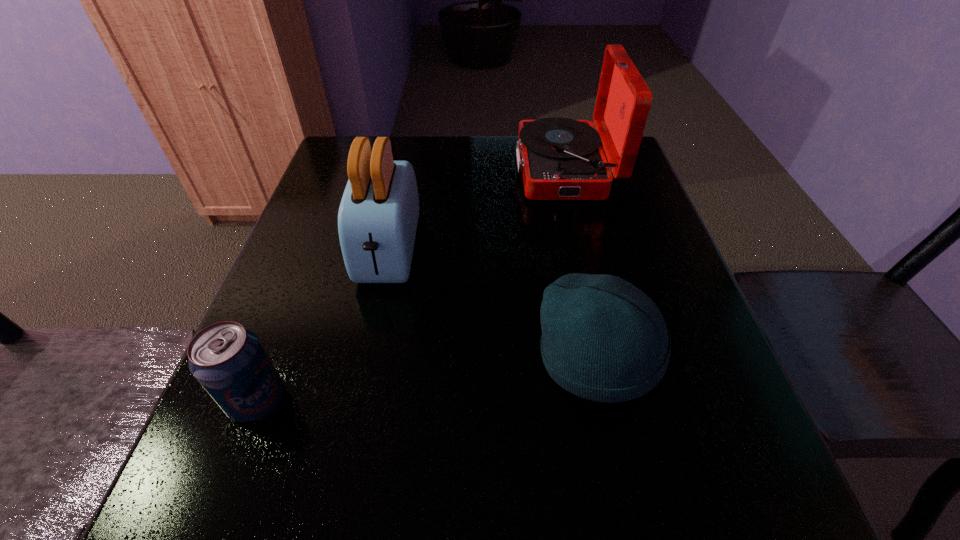
Select which object appears as the second closest to the farthest object. Please provide its 2D coordinates. Your answer should be formatted as a tuple, i.e. [(x, y)], where the tuple contains the x and y coordinates of a point satisfying the conditions above.

[(603, 339)]

I want to click on object that can be found as the third closest to the beanie, so [x=228, y=360].

Locate an element on the screen. free space that satisfies the following two spatial constraints: 1. on the back side of the beanie; 2. on the left side of the leftmost object is located at coordinates (274, 359).

At what (x,y) coordinates should I click in order to perform the action: click on free space that satisfies the following two spatial constraints: 1. on the side of the beanie with the lever; 2. on the left side of the third object from right to left. Please return your answer as a coordinate pair (x, y). Looking at the image, I should click on (367, 359).

The image size is (960, 540). In order to click on free space that satisfies the following two spatial constraints: 1. on the front-facing side of the phonograph_record; 2. on the front side of the leftmost object in this screenshot , I will do `click(620, 400)`.

This screenshot has width=960, height=540. I want to click on free space that satisfies the following two spatial constraints: 1. on the front-facing side of the phonograph_record; 2. on the side of the third nearest object with the lever, so click(x=585, y=252).

Identify the location of free space that satisfies the following two spatial constraints: 1. on the front-facing side of the farthest object; 2. on the side of the second farthest object with the lever. (585, 252).

Identify the location of vacant point that satisfies the following two spatial constraints: 1. on the side of the beanie with the lever; 2. on the right side of the second object from left to right. (367, 359).

I want to click on free point that satisfies the following two spatial constraints: 1. on the front-facing side of the farthest object; 2. on the side of the third nearest object with the lever, so (585, 252).